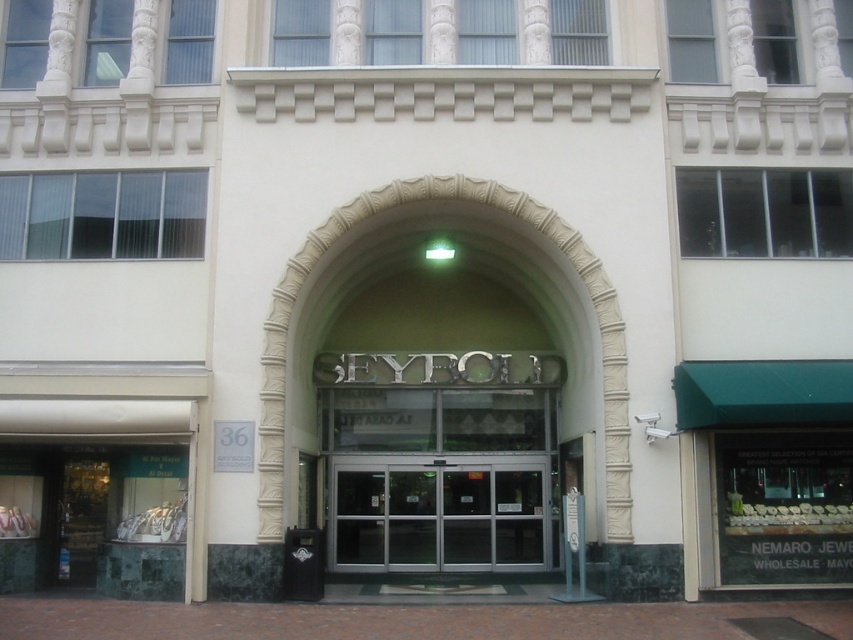
From the picture: How much distance is there between green marble display case at lower left and white stone archway at center?

The distance of green marble display case at lower left from white stone archway at center is 5.57 meters.

Between point (68, 472) and point (509, 205), which one is positioned in front?

Point (509, 205)

Where is `green marble display case at lower left`? The width and height of the screenshot is (853, 640). green marble display case at lower left is located at coordinates (102, 518).

Does green marble display case at lower left have a lesser width compared to transparent glass doors at center?

Yes, green marble display case at lower left is thinner than transparent glass doors at center.

Between green marble display case at lower left and transparent glass doors at center, which one is positioned lower?

transparent glass doors at center

Which is in front, point (173, 544) or point (546, 516)?

Point (173, 544)

Image resolution: width=853 pixels, height=640 pixels. What are the coordinates of `green marble display case at lower left` in the screenshot? It's located at (102, 518).

Which is behind, point (422, 532) or point (463, 186)?

Point (422, 532)

Identify the location of transparent glass doors at center. (439, 515).